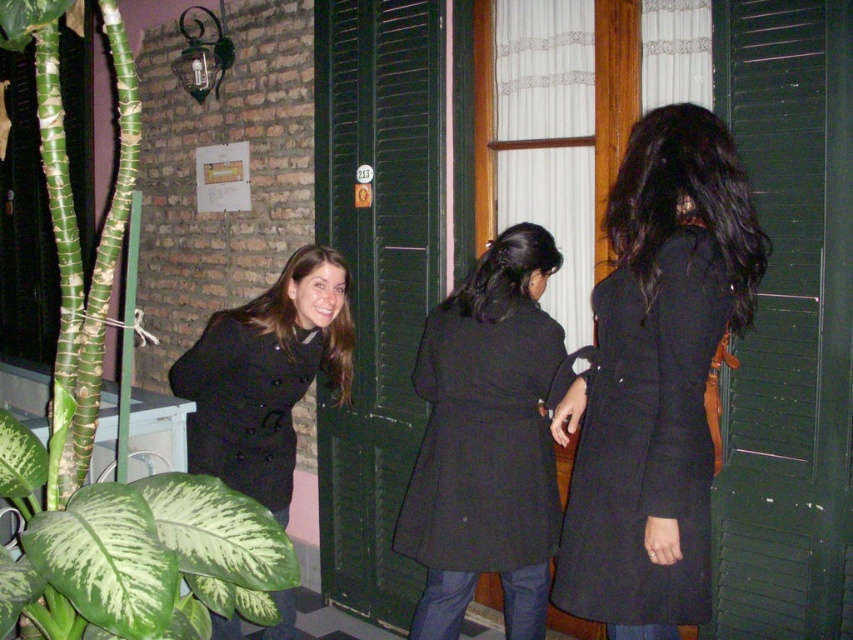
Between black matte coat at center and matte black coat at left, which one has more height?

Standing taller between the two is matte black coat at left.

Is black matte coat at center shorter than matte black coat at left?

Yes.

Which is in front, point (743, 273) or point (206, 380)?

Positioned in front is point (743, 273).

Locate an element on the screen. This screenshot has width=853, height=640. black matte coat at center is located at coordinates (686, 204).

The image size is (853, 640). Find the location of `green leafy plant at left`. green leafy plant at left is located at coordinates (94, 429).

Does point (47, 26) lie in front of point (675, 348)?

Yes.

Locate an element on the screen. The width and height of the screenshot is (853, 640). green leafy plant at left is located at coordinates (94, 429).

Is black wool coat at center smaller than matte black coat at left?

No.

Is black wool coat at center positioned behind matte black coat at left?

No, black wool coat at center is closer to the viewer.

Does point (541, 364) lie behind point (245, 413)?

No, (541, 364) is in front of (245, 413).

The width and height of the screenshot is (853, 640). Identify the location of black wool coat at center. (485, 440).